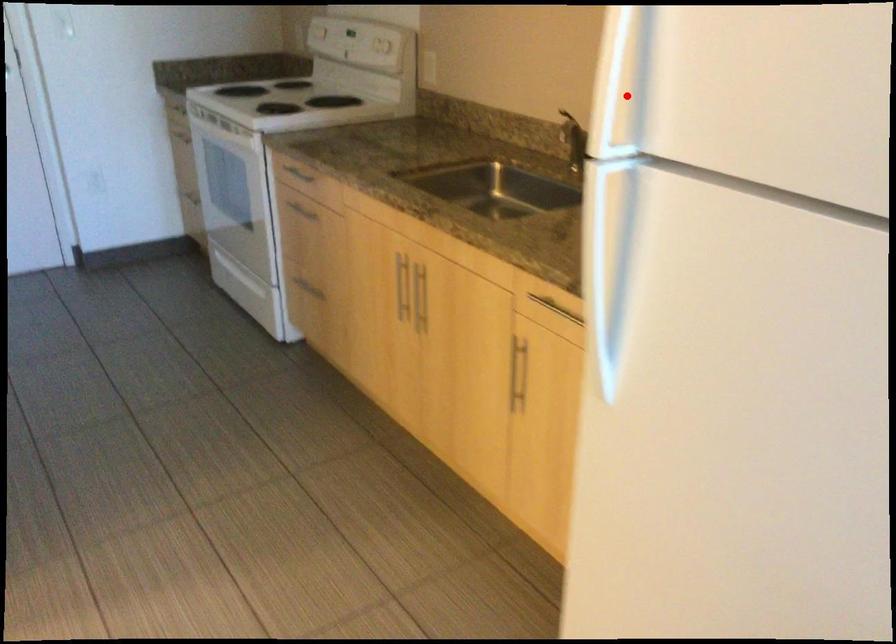
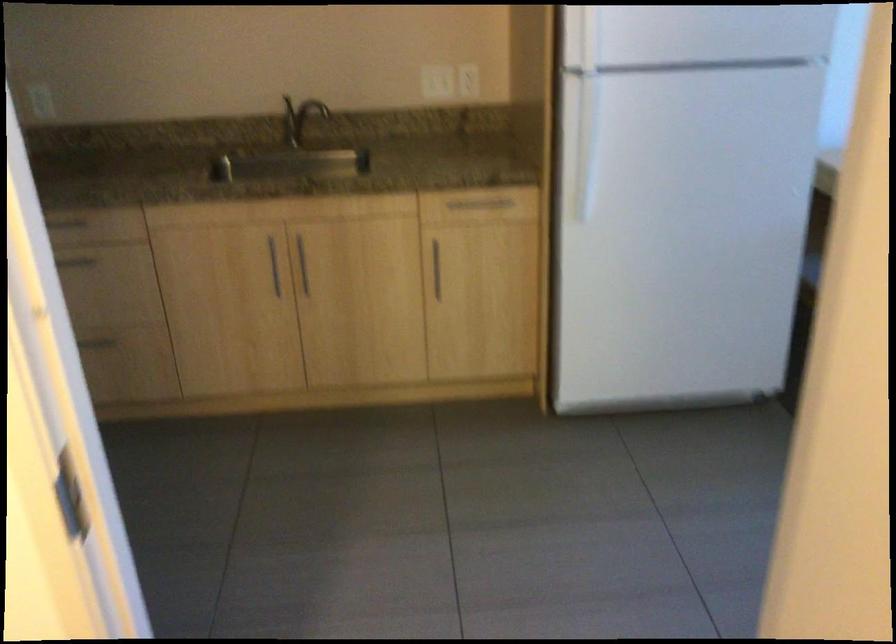
Where in the second image is the point corresponding to the highlighted location from the first image?

(581, 39)